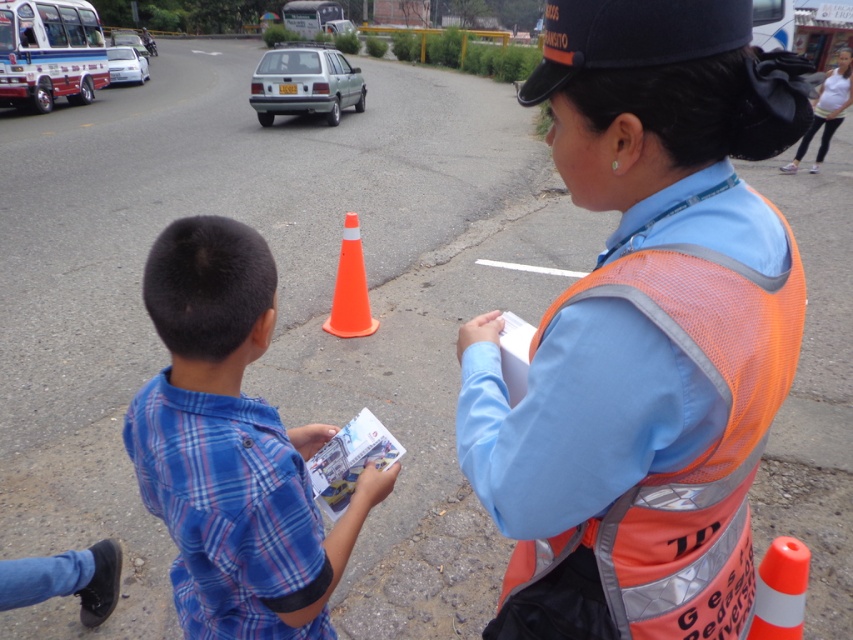
Does orange reflective vest at center appear over white cotton shirt at upper right?

Answer: Incorrect, orange reflective vest at center is not positioned above white cotton shirt at upper right.

Can you confirm if orange reflective vest at center is positioned to the left of white cotton shirt at upper right?

Yes, orange reflective vest at center is to the left of white cotton shirt at upper right.

Locate an element on the screen. The height and width of the screenshot is (640, 853). orange reflective vest at center is located at coordinates (645, 330).

Find the location of a particular element. The width and height of the screenshot is (853, 640). orange reflective vest at center is located at coordinates (645, 330).

The height and width of the screenshot is (640, 853). I want to click on blue plaid shirt at center, so click(231, 448).

Between blue plaid shirt at center and white cotton shirt at upper right, which one appears on the right side from the viewer's perspective?

Positioned to the right is white cotton shirt at upper right.

What do you see at coordinates (231, 448) in the screenshot? This screenshot has width=853, height=640. I see `blue plaid shirt at center` at bounding box center [231, 448].

The height and width of the screenshot is (640, 853). In order to click on blue plaid shirt at center in this screenshot , I will do `click(231, 448)`.

Is orange reflective cone at center smaller than orange plastic traffic cone at center?

Yes, orange reflective cone at center is smaller than orange plastic traffic cone at center.

Can you confirm if orange reflective cone at center is taller than orange plastic traffic cone at center?

Incorrect, orange reflective cone at center's height is not larger of orange plastic traffic cone at center's.

Does point (793, 636) come in front of point (341, 241)?

Yes, it is in front of point (341, 241).

Find the location of a particular element. orange reflective cone at center is located at coordinates (780, 589).